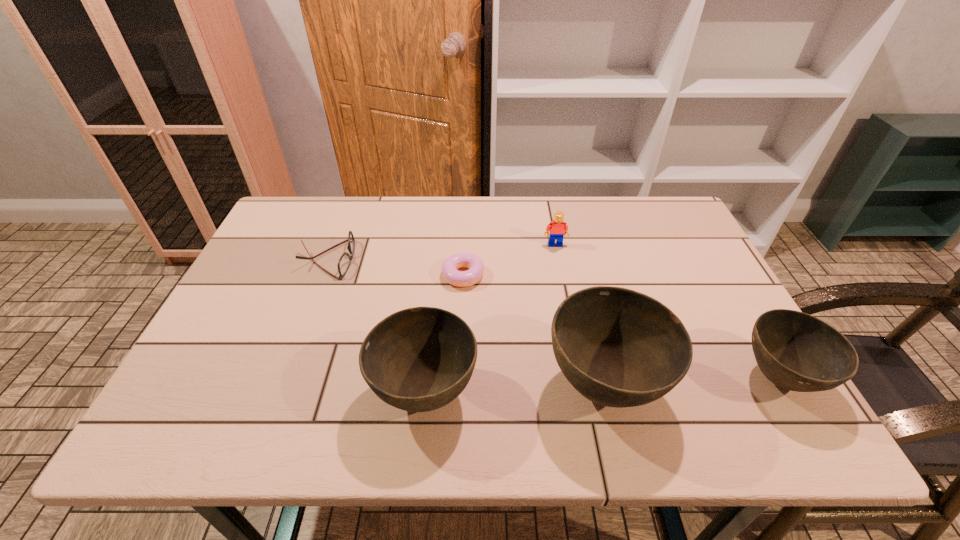
Please point a vacant point for placing a bowl on the left. Please provide its 2D coordinates. Your answer should be formatted as a tuple, i.e. [(x, y)], where the tuple contains the x and y coordinates of a point satisfying the conditions above.

[(241, 400)]